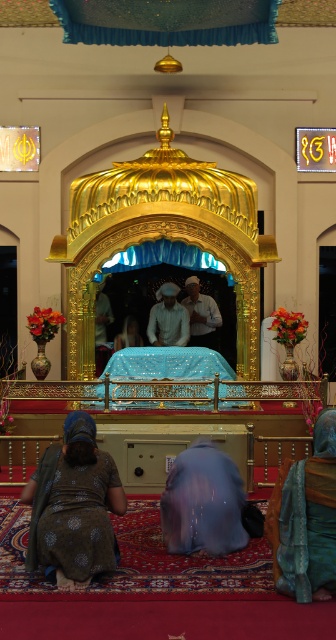
Is dark brown fabric at lower left taller than white matte robe at center?

Correct, dark brown fabric at lower left is much taller as white matte robe at center.

This screenshot has width=336, height=640. I want to click on dark brown fabric at lower left, so click(x=73, y=506).

The height and width of the screenshot is (640, 336). I want to click on dark brown fabric at lower left, so click(x=73, y=506).

Consider the image. Measure the distance from dark brown fabric at lower left to blue satin robe at center.

1.72 meters

Is point (98, 458) farther from viewer compared to point (232, 486)?

No, it is in front of (232, 486).

Is point (87, 529) more distant than point (229, 497)?

No, it is not.

Locate an element on the screen. This screenshot has height=640, width=336. dark brown fabric at lower left is located at coordinates (73, 506).

Looking at this image, is teal fabric robe at lower right below blue satin robe at center?

No.

Which is behind, point (333, 465) or point (168, 488)?

The point (168, 488) is behind.

Between point (320, 486) and point (182, 524), which one is positioned behind?

Positioned behind is point (182, 524).

Find the location of a particular element. teal fabric robe at lower right is located at coordinates (306, 518).